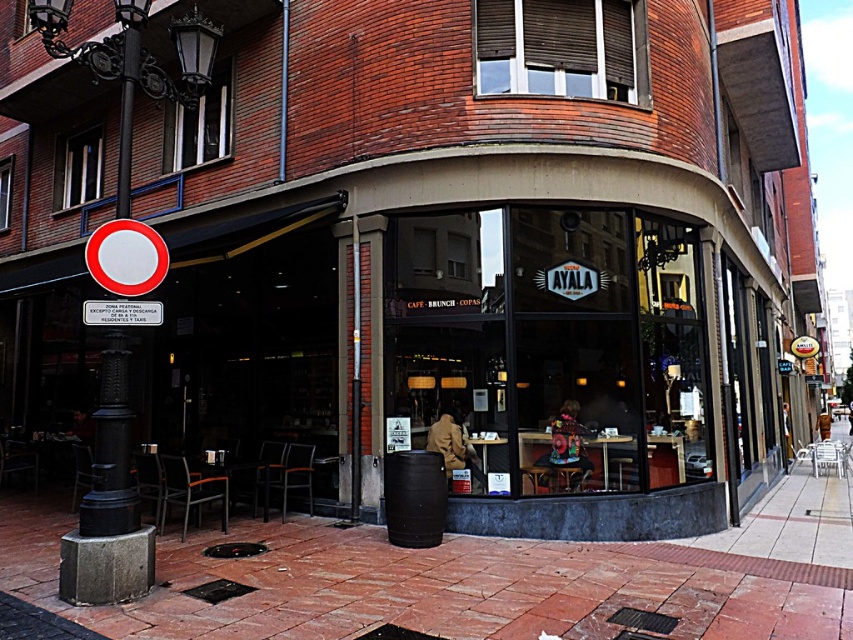
Question: Does brick pavement at lower center appear on the left side of black cast iron pole at left?

Choices:
 (A) yes
 (B) no

Answer: (B)

Question: Is brick pavement at lower center smaller than black cast iron pole at left?

Choices:
 (A) yes
 (B) no

Answer: (B)

Question: Among these objects, which one is farthest from the camera?

Choices:
 (A) brick pavement at lower center
 (B) black cast iron pole at left

Answer: (B)

Question: Which of the following is the closest to the observer?

Choices:
 (A) black cast iron pole at left
 (B) brick pavement at lower center

Answer: (B)

Question: Is brick pavement at lower center positioned behind black cast iron pole at left?

Choices:
 (A) no
 (B) yes

Answer: (A)

Question: Which point appears closest to the camera in this image?

Choices:
 (A) (190, 632)
 (B) (126, 168)

Answer: (A)